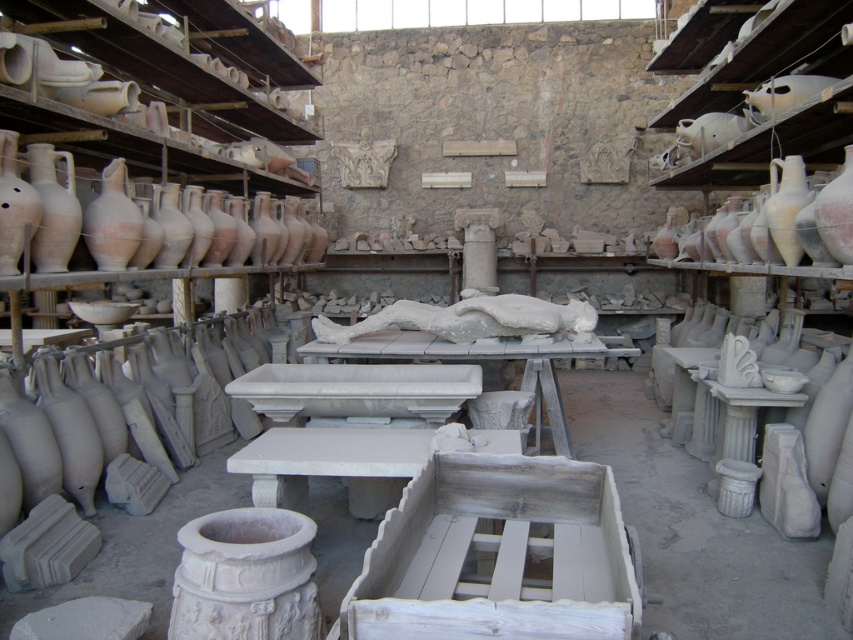
You are an archaeologist organizing artifacts in the workshop. You need to place the white matte sculpture at center and the matte clay vase at left onto a display table. The table has a width of 1.2 meters. Can both items fit side by side without overlapping?

The white matte sculpture at center is wider than the matte clay vase at left. Since the table is 1.2 meters wide, we need to know the combined width of both items to determine if they can fit. However, the exact widths are not provided. The question cannot be answered definitively with the given information.

You are an archaeologist working in this ancient storage room. You need to place both the matte clay amphora at left and the matte clay vase at left onto a wooden shelf that can only hold items narrower than 50 cm. Based on their widths, can both items fit on the shelf?

The matte clay amphora at left is wider than the matte clay vase at left. Since the amphora is wider and the shelf can only hold items narrower than 50 cm, we need to know the exact width of the amphora. However, the description only states that the amphora is wider than the vase. Without specific measurements for both items, we cannot confirm if both will fit. Please provide the exact widths of both items for an accurate assessment.